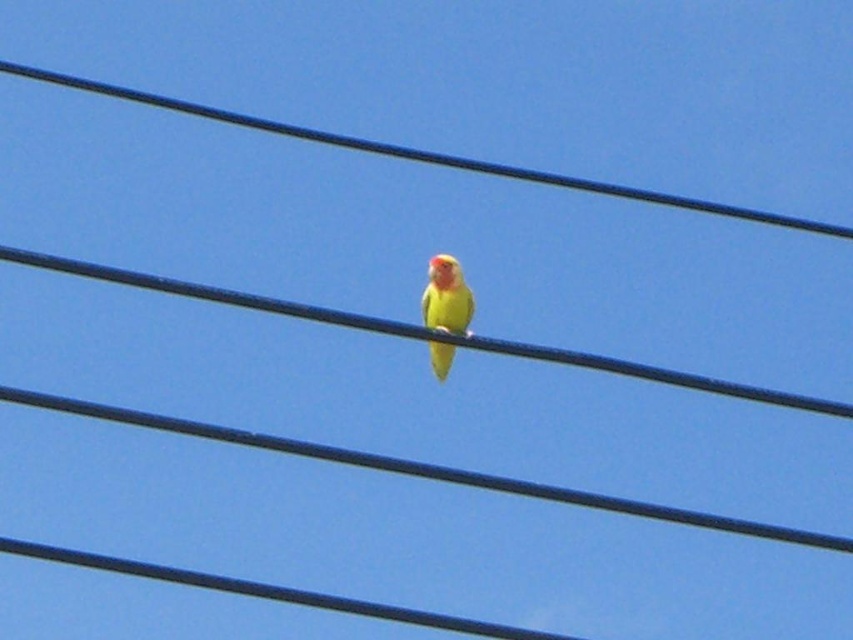
Question: Does black wire at center lie in front of yellow matte parrot at center?

Choices:
 (A) yes
 (B) no

Answer: (A)

Question: Is the position of black wire at center more distant than that of yellow matte parrot at center?

Choices:
 (A) no
 (B) yes

Answer: (A)

Question: Observing the image, what is the correct spatial positioning of black wire at center in reference to yellow matte parrot at center?

Choices:
 (A) above
 (B) below

Answer: (A)